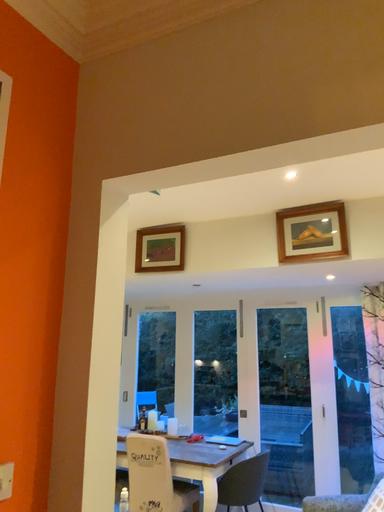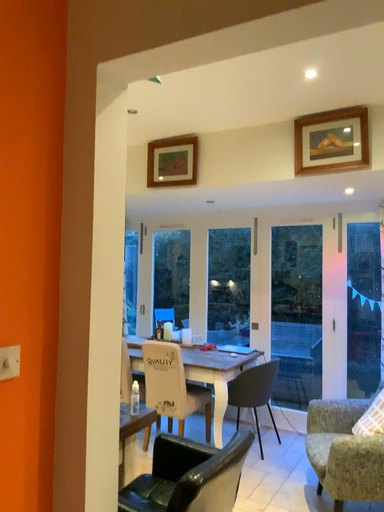
Question: Which way did the camera rotate in the video?

Choices:
 (A) rotated upward
 (B) rotated downward

Answer: (B)